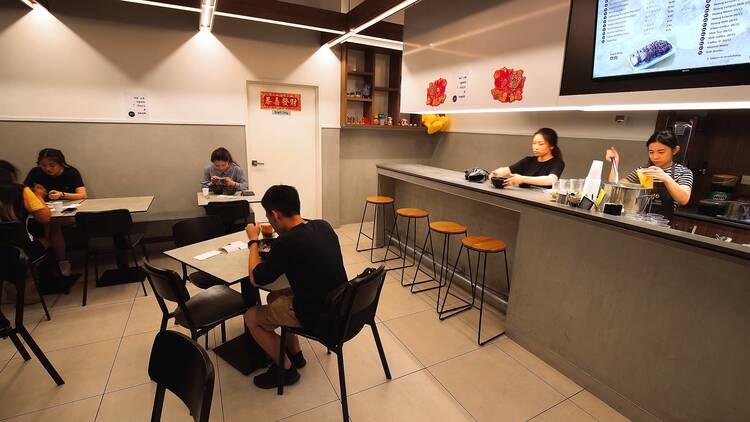
Identify the location of table. (214, 249), (222, 194), (120, 199), (58, 205), (435, 172), (698, 216).